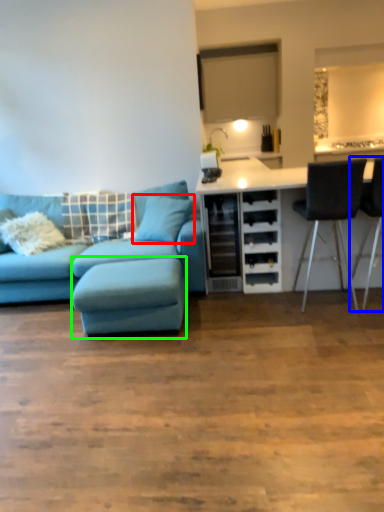
Question: Considering the real-world distances, which object is closest to pillow (highlighted by a red box)? chair (highlighted by a blue box) or footrest (highlighted by a green box).

Choices:
 (A) chair
 (B) footrest

Answer: (B)